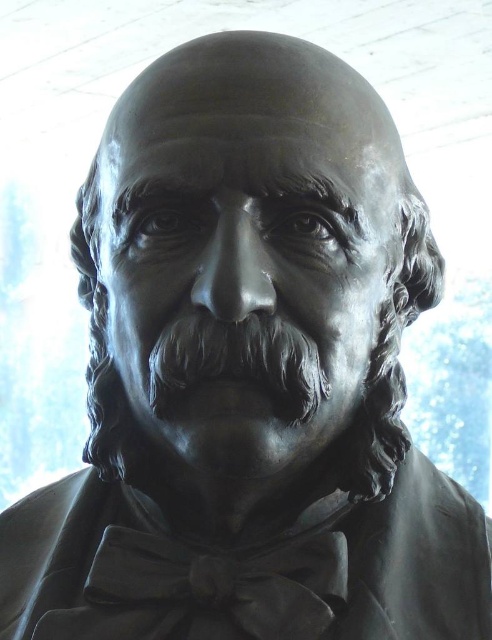
You are an art conservator examining the bronze bust sculpture. You need to ensure the distance between the black satin bow tie at center and the black matte beard at center is safe for preservation. The recommended minimum distance for preservation is 5 inches. Is the current distance sufficient?

The black satin bow tie at center is 5.77 inches away from the black matte beard at center, which exceeds the recommended minimum distance of 5 inches. Therefore, the current distance is sufficient for preservation.

You are an art student analyzing the sculpture. The bow tie is crucial for understanding the subject. Where is the black satin bow tie at center located in terms of coordinates?

The black satin bow tie at center is located at coordinates point (215,588).

You are an art student analyzing the sculpture. You notice the black satin bow tie at center and the black matte beard at center. Which of these two elements is taller in the sculpture?

The black satin bow tie at center is much taller than the black matte beard at center in the sculpture.